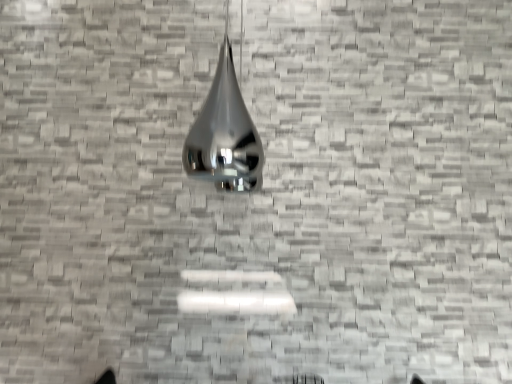
Find the location of a particular element. shiny metallic pendant light at center is located at coordinates (225, 134).

The width and height of the screenshot is (512, 384). What do you see at coordinates (225, 134) in the screenshot? I see `shiny metallic pendant light at center` at bounding box center [225, 134].

Find the location of a particular element. The image size is (512, 384). shiny metallic pendant light at center is located at coordinates (225, 134).